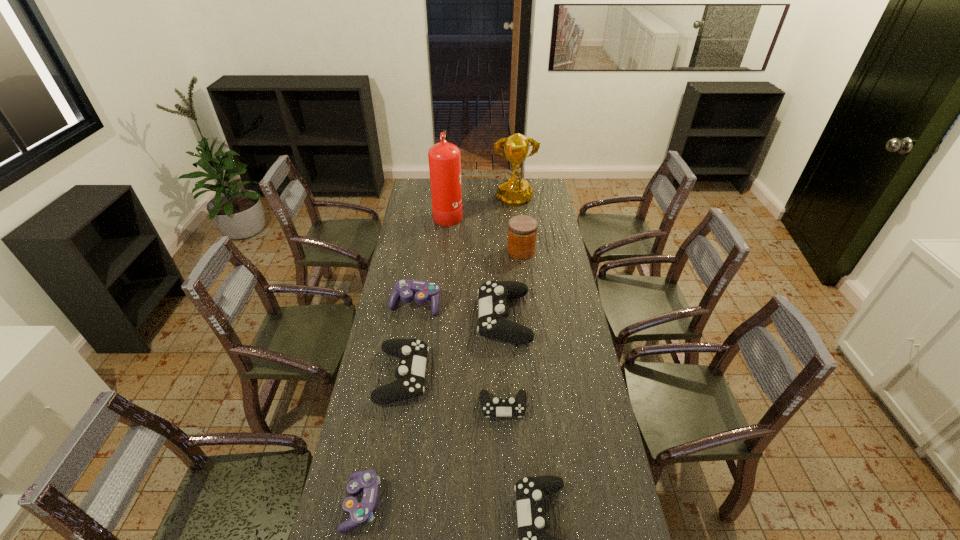
The image size is (960, 540). I want to click on fire extinguisher, so click(444, 158).

Find the location of `red fire extinguisher`. red fire extinguisher is located at coordinates (444, 158).

The height and width of the screenshot is (540, 960). I want to click on gold award, so click(515, 191).

The width and height of the screenshot is (960, 540). I want to click on the eighth shortest object, so click(x=515, y=191).

Where is `the seventh shortest object`? This screenshot has height=540, width=960. the seventh shortest object is located at coordinates (522, 230).

Identify the location of jar. (522, 230).

You are a GUI agent. You are given a task and a screenshot of the screen. Output one action in this format:
    pyautogui.click(x=<x>, y=<y>)
    Task: Click on the tallest control
    The image size is (960, 540).
    Given the screenshot: What is the action you would take?
    pyautogui.click(x=493, y=311)

The width and height of the screenshot is (960, 540). Identify the location of the fourth tallest object. [493, 311].

Image resolution: width=960 pixels, height=540 pixels. Find the location of `the bigger purple control`. the bigger purple control is located at coordinates 423,291.

Find the location of `the leftmost black control`. the leftmost black control is located at coordinates (410, 373).